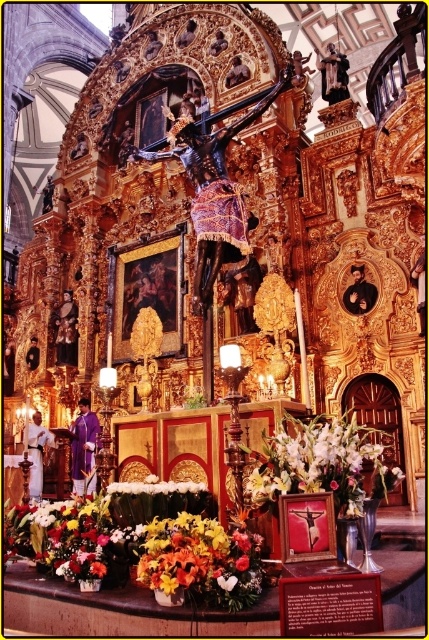
Question: Which of these objects is positioned farthest from the white silk flowers at center?

Choices:
 (A) white floral bouquet at center
 (B) floral bouquet at lower center

Answer: (A)

Question: Which of the following is the closest to the observer?

Choices:
 (A) (204, 483)
 (B) (347, 458)
 (C) (220, 540)

Answer: (C)

Question: Does white silk flowers at center have a lesser width compared to white floral bouquet at center?

Choices:
 (A) yes
 (B) no

Answer: (B)

Question: Which of the following is the farthest from the observer?

Choices:
 (A) (193, 490)
 (B) (395, 477)

Answer: (A)

Question: Is floral bouquet at lower center to the right of white floral bouquet at center from the viewer's perspective?

Choices:
 (A) yes
 (B) no

Answer: (B)

Question: Is floral bouquet at lower center above white floral bouquet at center?

Choices:
 (A) no
 (B) yes

Answer: (A)